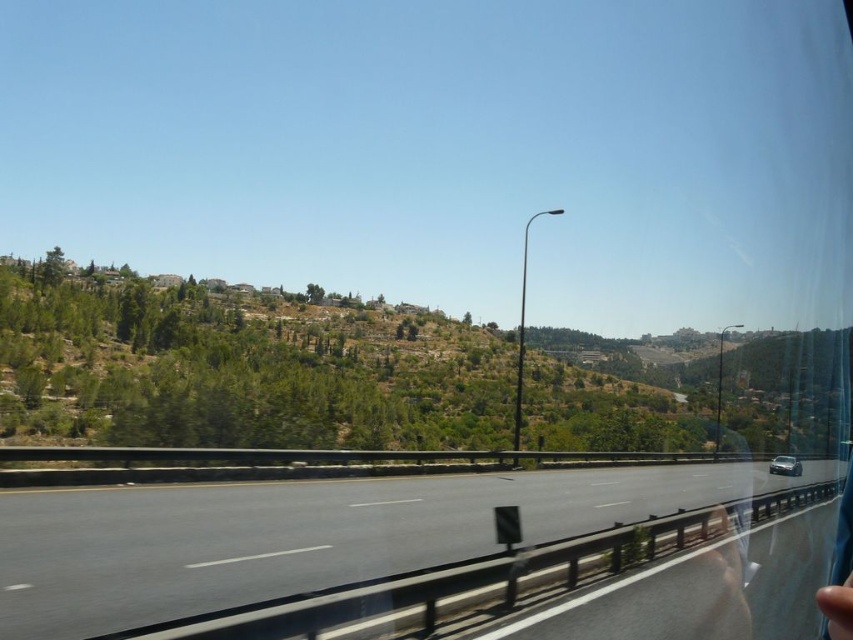
You are a passenger in a car and you look out the window. You see the black asphalt highway at center and the silver metallic car at center. Which one takes up more space in the view?

The black asphalt highway at center is bigger than the silver metallic car at center, so it takes up more space in the view.

You are a GPS navigator trying to determine the position of the black asphalt highway at center in the image. What are its coordinates?

The black asphalt highway at center is located at coordinates point (297, 532).

You are a passenger in a car and you see the black asphalt highway at center and the silver metallic car at center. Which one is wider?

The black asphalt highway at center is wider than the silver metallic car at center according to the description.